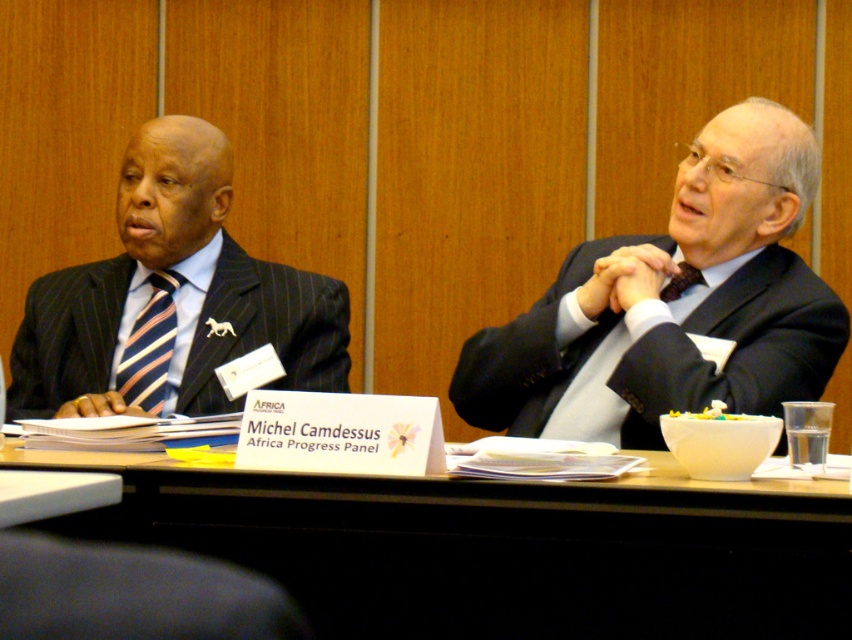
Is matte black suit at center taller than striped fabric tie at left?

Indeed, matte black suit at center has a greater height compared to striped fabric tie at left.

Is point (563, 401) behind point (127, 355)?

No.

Identify the location of matte black suit at center. The height and width of the screenshot is (640, 852). (672, 305).

Is wooden table at center wider than matte black suit at center?

Indeed, wooden table at center has a greater width compared to matte black suit at center.

Based on the photo, does wooden table at center have a smaller size compared to matte black suit at center?

Indeed, wooden table at center has a smaller size compared to matte black suit at center.

Where is `wooden table at center`? This screenshot has height=640, width=852. wooden table at center is located at coordinates (505, 550).

Locate an element on the screen. This screenshot has width=852, height=640. wooden table at center is located at coordinates (505, 550).

Consider the image. Does matte black suit at left appear on the right side of striped fabric tie at left?

Yes, matte black suit at left is to the right of striped fabric tie at left.

Is matte black suit at left bigger than striped fabric tie at left?

Indeed, matte black suit at left has a larger size compared to striped fabric tie at left.

Find the location of `matte black suit at left`. matte black suit at left is located at coordinates (171, 300).